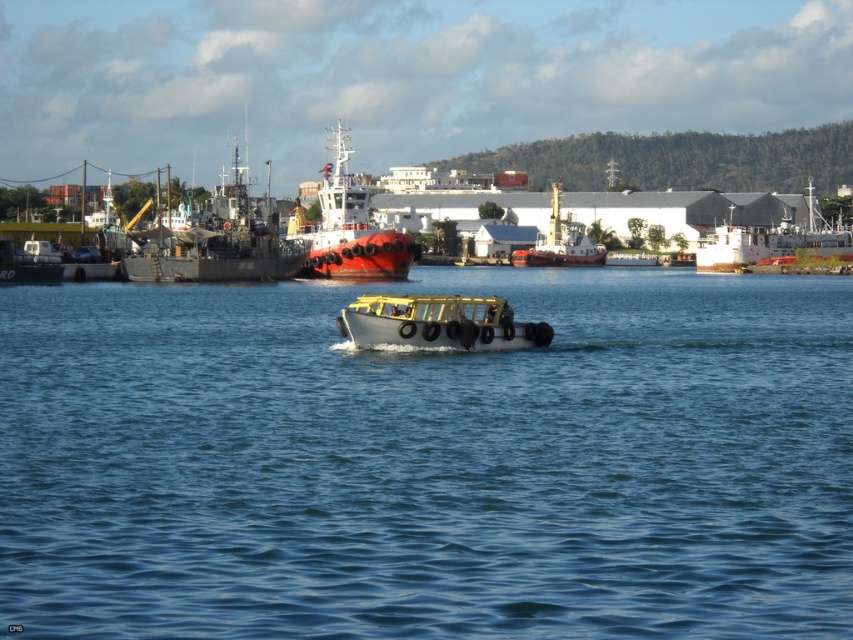
Is point (221, 259) more distant than point (349, 154)?

No, it is not.

Can you confirm if dark gray metal ship at left is bigger than red glossy ship at center?

Incorrect, dark gray metal ship at left is not larger than red glossy ship at center.

Image resolution: width=853 pixels, height=640 pixels. What do you see at coordinates (216, 243) in the screenshot?
I see `dark gray metal ship at left` at bounding box center [216, 243].

You are a GUI agent. You are given a task and a screenshot of the screen. Output one action in this format:
    pyautogui.click(x=<x>, y=<y>)
    Task: Click on the dark gray metal ship at left
    
    Given the screenshot: What is the action you would take?
    pyautogui.click(x=216, y=243)

Who is more distant from viewer, (265, 216) or (563, 256)?

The point (563, 256) is more distant.

From the picture: Who is shorter, dark gray metal ship at left or yellow rubber boat at center?

Standing shorter between the two is yellow rubber boat at center.

Does point (202, 224) lie in front of point (554, 198)?

Yes, point (202, 224) is closer to viewer.

The width and height of the screenshot is (853, 640). What are the coordinates of `dark gray metal ship at left` in the screenshot? It's located at (216, 243).

The width and height of the screenshot is (853, 640). What are the coordinates of `clear blue water at center` in the screenshot? It's located at (428, 461).

Does clear blue water at center appear on the left side of yellow rubber boat at center?

Yes, clear blue water at center is to the left of yellow rubber boat at center.

Describe the element at coordinates (428, 461) in the screenshot. The width and height of the screenshot is (853, 640). I see `clear blue water at center` at that location.

Image resolution: width=853 pixels, height=640 pixels. In order to click on clear blue water at center in this screenshot , I will do `click(428, 461)`.